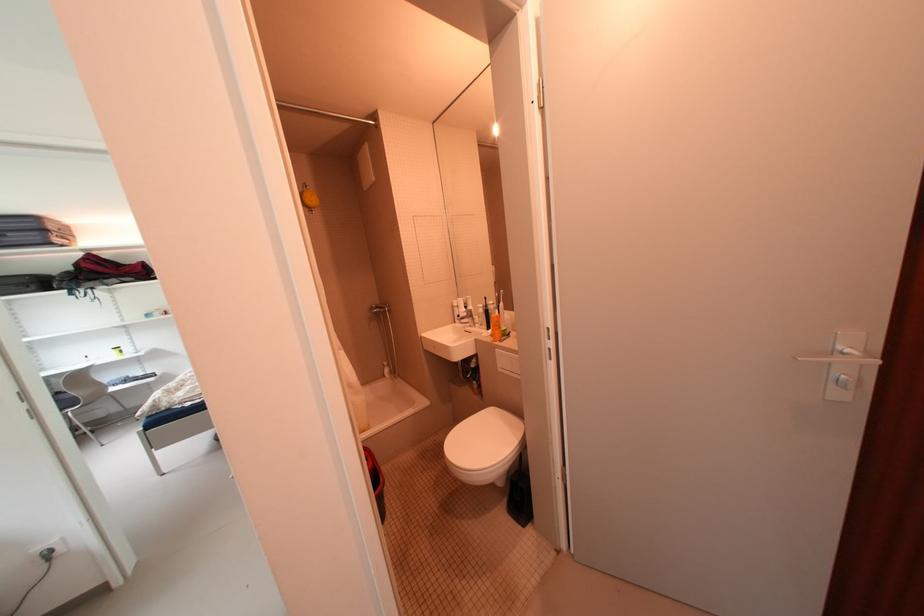
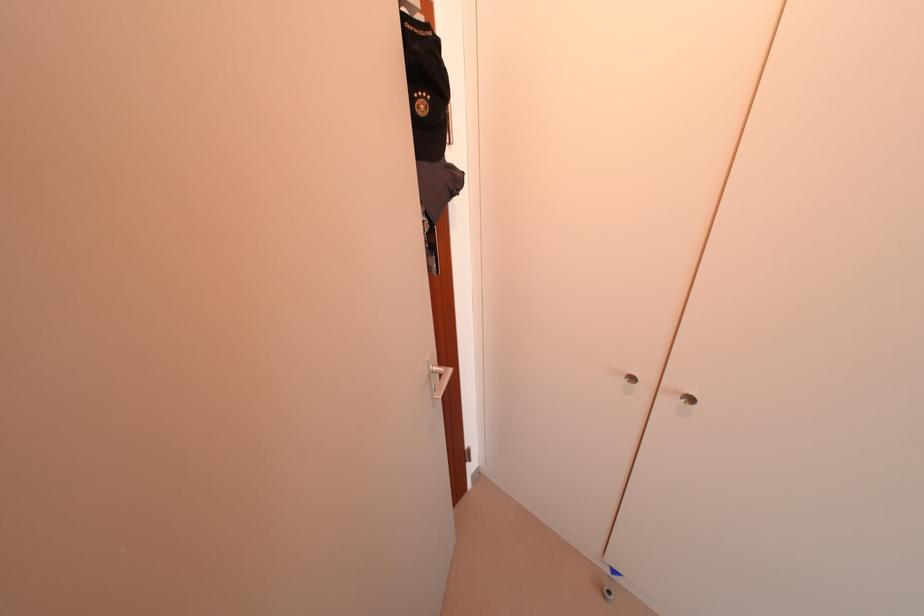
Based on the continuous images, in which direction is the camera rotating?

The rotation direction of the camera is right-down.